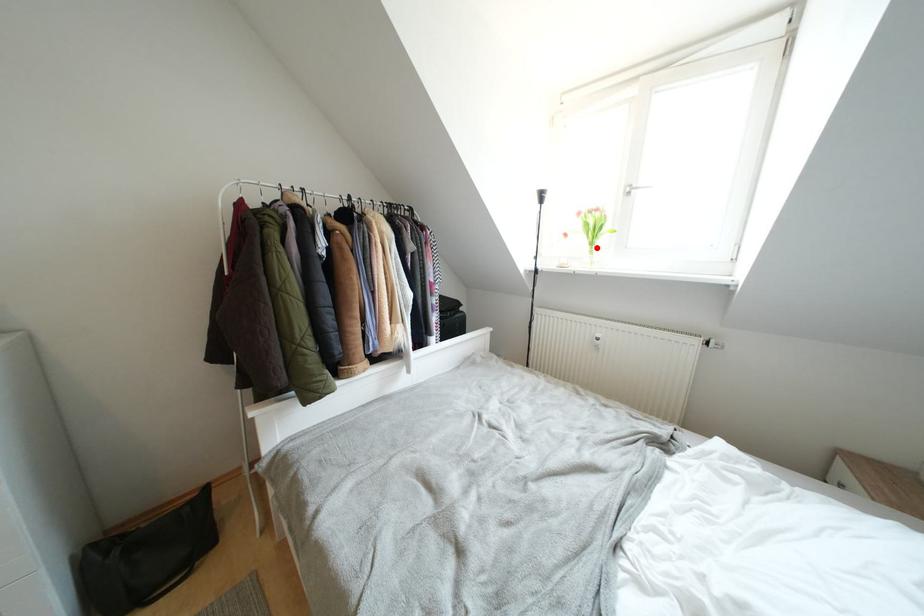
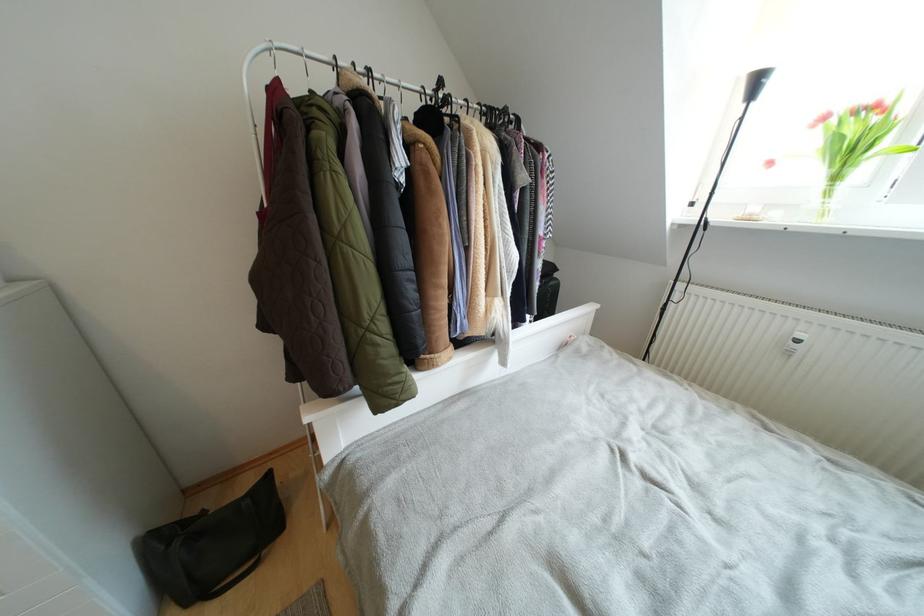
Question: I am providing you with two images of the same scene from different viewpoints. Image1 has a red point marked. In image2, the corresponding 3D location appears at what relative position? Reply with the corresponding letter.

Choices:
 (A) Closer
 (B) Farther

Answer: (B)